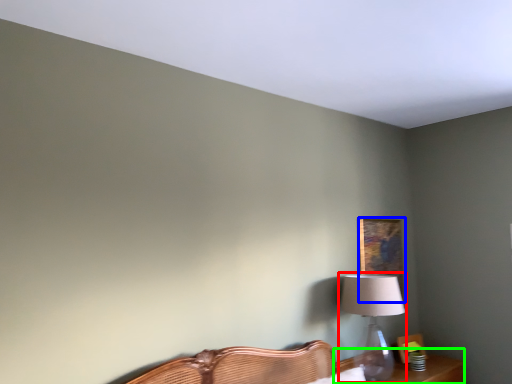
Question: Estimate the real-world distances between objects in this image. Which object is closer to table lamp (highlighted by a red box), picture frame (highlighted by a blue box) or table (highlighted by a green box)?

Choices:
 (A) picture frame
 (B) table

Answer: (B)